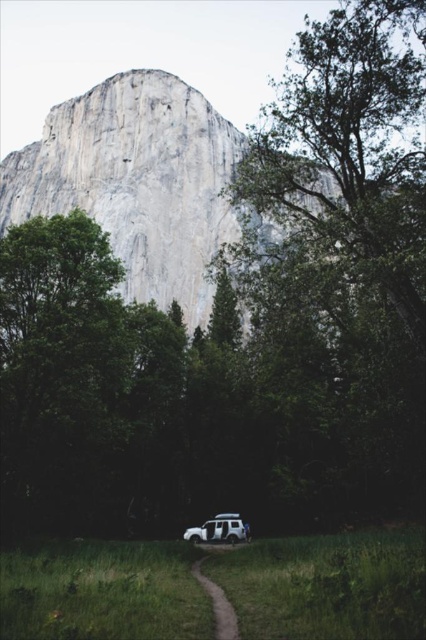
You are a hiker standing at the white matte jeep at lower center and want to follow the dirt path at center towards the rock formation. In which direction should you head relative to your current position?

The dirt path at center is to the left of white matte jeep at lower center, so you should head to your left to follow the dirt path at center towards the rock formation.

From the picture: You are standing at the starting point of the dirt path at center. If you walk straight ahead, will you eventually reach the large, imposing rock formation in the background?

The dirt path at center is positioned at point (x=218, y=604), which is along the central axis of the scene. Since the rock formation is the dominant feature in the background, walking straight along the dirt path at center would lead towards the rock formation.